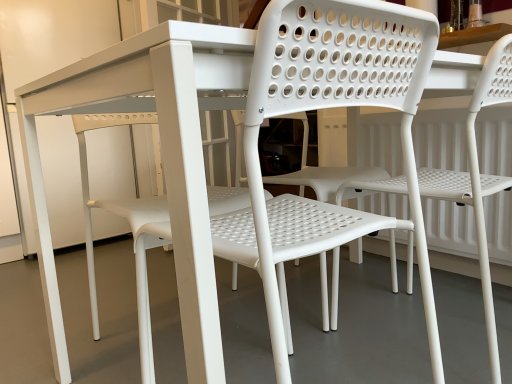
You are a GUI agent. You are given a task and a screenshot of the screen. Output one action in this format:
    pyautogui.click(x=<x>, y=<y>)
    Task: Click on the vacant location behind white plastic chair at center, the second chair from the left
    The height and width of the screenshot is (384, 512).
    Given the screenshot: What is the action you would take?
    pyautogui.click(x=379, y=284)